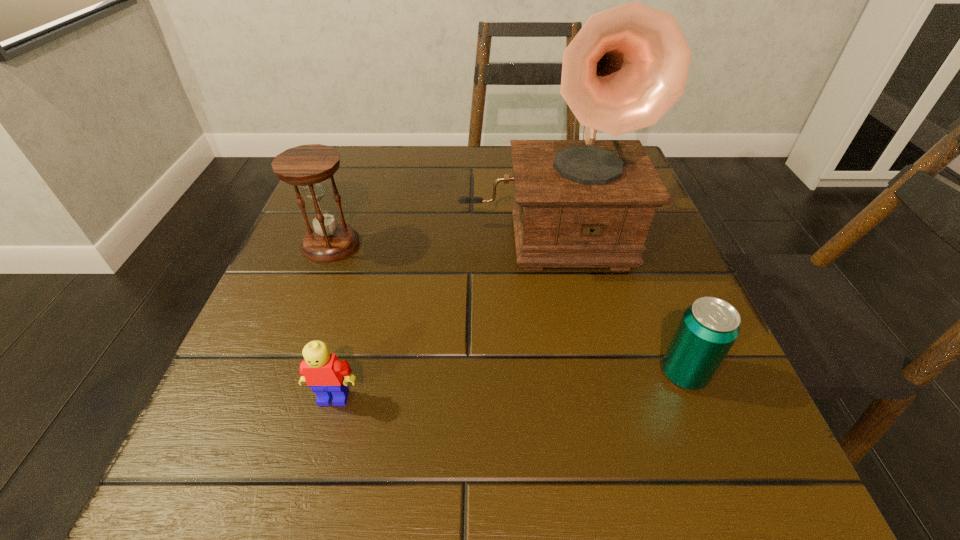
The width and height of the screenshot is (960, 540). Identify the location of record player situated at the right edge. (589, 203).

You are a GUI agent. You are given a task and a screenshot of the screen. Output one action in this format:
    pyautogui.click(x=<x>, y=<y>)
    Task: Click on the beer can present at the right edge
    
    Given the screenshot: What is the action you would take?
    pyautogui.click(x=709, y=327)

Identify the location of object that is at the far right corner. (589, 203).

At what (x,y) coordinates should I click in order to perform the action: click on free spot at the far edge of the desktop. Please return your answer as a coordinate pair (x, y). Looking at the image, I should click on (437, 204).

The width and height of the screenshot is (960, 540). Find the location of `free region at the near edge of the desktop`. free region at the near edge of the desktop is located at coordinates (429, 478).

Where is `blank space at the left edge of the desktop`? This screenshot has height=540, width=960. blank space at the left edge of the desktop is located at coordinates (297, 334).

Find the location of a particular element. vacant space at the right edge of the desktop is located at coordinates (671, 401).

I want to click on blank space at the far left corner, so click(354, 147).

In the image, there is a desktop. Identify the location of blank space at the near right corner. Image resolution: width=960 pixels, height=540 pixels. (643, 466).

This screenshot has height=540, width=960. Identify the location of free point between the record player and the hourglass. (438, 237).